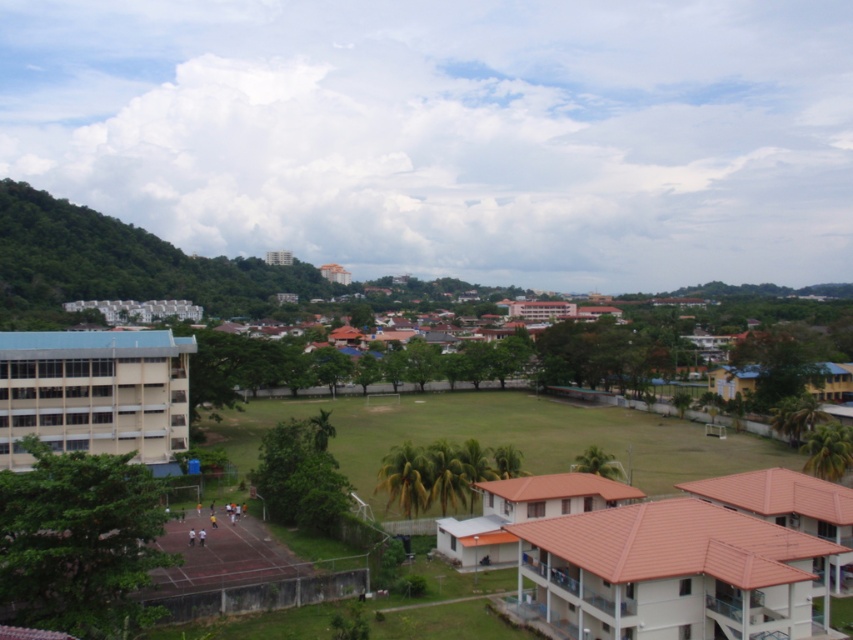
You are standing on the sports field and want to walk to the yellow matte building at right. Which direction should you walk relative to the brown tile roof house at center?

You should walk towards the yellow matte building at right, which is above the brown tile roof house at center, so you should walk upwards from the brown tile roof house at center.

You are standing at the center of the sports field in the image. You want to walk directly towards the white tile building at lower right. What direction should you head?

The white tile building at lower right is located at coordinates point [674,573], so you should head towards the lower right direction from the center of the sports field.

You are a drone operator who needs to fly a drone from the brown tile roof house at center to the yellow matte building at right. Based on the scene, which direction should you fly the drone to reach the destination?

The brown tile roof house at center is to the left of the yellow matte building at right, so you should fly the drone to the right to reach the yellow matte building at right.